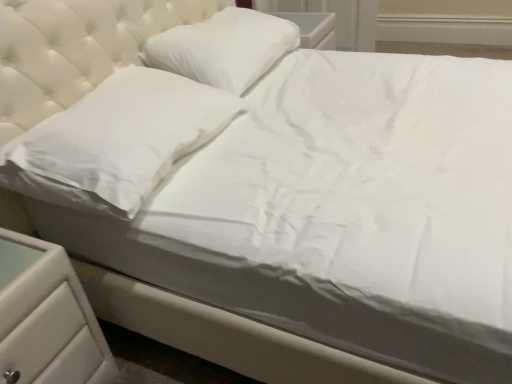
Describe the element at coordinates (224, 48) in the screenshot. I see `white smooth pillow at upper center, the 2th pillow from the front` at that location.

Describe the element at coordinates (116, 141) in the screenshot. I see `white smooth pillow at left, which is the first pillow in front-to-back order` at that location.

Describe the element at coordinates (46, 318) in the screenshot. I see `white plastic drawer at lower left` at that location.

Locate an element on the screen. white smooth pillow at upper center, the 2th pillow from the front is located at coordinates (224, 48).

Which point is more distant from viewer, (88, 336) or (212, 129)?

The point (212, 129) is more distant.

Which object is further away from the camera taking this photo, white plastic drawer at lower left or white smooth pillow at left, which appears as the second pillow when viewed from the back?

white smooth pillow at left, which appears as the second pillow when viewed from the back.

Where is `nightstand in front of the white smooth pillow at left, which is the first pillow in front-to-back order`? nightstand in front of the white smooth pillow at left, which is the first pillow in front-to-back order is located at coordinates coord(46,318).

How different are the orientations of white plastic drawer at lower left and white smooth pillow at left, which appears as the second pillow when viewed from the back, in degrees?

The angle between the facing direction of white plastic drawer at lower left and the facing direction of white smooth pillow at left, which appears as the second pillow when viewed from the back, is 1.81 degrees.

Does white smooth pillow at left, which is the first pillow in front-to-back order, have a greater width compared to white plastic drawer at lower left?

No, white smooth pillow at left, which is the first pillow in front-to-back order, is not wider than white plastic drawer at lower left.

Consider the image. From a real-world perspective, who is located lower, white smooth pillow at left, which appears as the second pillow when viewed from the back, or white plastic drawer at lower left?

From a 3D spatial view, white plastic drawer at lower left is below.

Is point (151, 87) farther from viewer compared to point (36, 293)?

Yes.

Is white smooth pillow at left, which appears as the second pillow when viewed from the back, looking in the opposite direction of white plastic drawer at lower left?

No, white smooth pillow at left, which appears as the second pillow when viewed from the back, is not facing the opposite direction of white plastic drawer at lower left.

Between white plastic drawer at lower left and white smooth pillow at upper center, the 2th pillow from the front, which one has less height?

white smooth pillow at upper center, the 2th pillow from the front.

Is white plastic drawer at lower left not within white smooth pillow at upper center, positioned as the first pillow in back-to-front order?

Indeed, white plastic drawer at lower left is completely outside white smooth pillow at upper center, positioned as the first pillow in back-to-front order.

Considering the sizes of objects white plastic drawer at lower left and white smooth pillow at upper center, positioned as the first pillow in back-to-front order, in the image provided, who is smaller, white plastic drawer at lower left or white smooth pillow at upper center, positioned as the first pillow in back-to-front order,?

white plastic drawer at lower left is smaller.

From the image's perspective, which object appears higher, white smooth pillow at left, which appears as the second pillow when viewed from the back, or white smooth pillow at upper center, the 2th pillow from the front?

white smooth pillow at upper center, the 2th pillow from the front.

This screenshot has width=512, height=384. I want to click on pillow below the white smooth pillow at upper center, the 2th pillow from the front (from the image's perspective), so click(116, 141).

Does point (59, 135) come in front of point (243, 74)?

That is True.

Can we say white smooth pillow at left, which appears as the second pillow when viewed from the back, lies outside white smooth pillow at upper center, positioned as the first pillow in back-to-front order?

white smooth pillow at left, which appears as the second pillow when viewed from the back, lies outside white smooth pillow at upper center, positioned as the first pillow in back-to-front order,'s area.

Is white smooth pillow at upper center, the 2th pillow from the front, in front of white plastic drawer at lower left?

No, it is not.

From the image's perspective, is white smooth pillow at upper center, the 2th pillow from the front, over white plastic drawer at lower left?

Yes.

In order to click on the 2nd pillow above the white plastic drawer at lower left (from the image's perspective) in this screenshot , I will do `click(224, 48)`.

Considering the sizes of white smooth pillow at upper center, the 2th pillow from the front, and white smooth pillow at left, which is the first pillow in front-to-back order, in the image, is white smooth pillow at upper center, the 2th pillow from the front, bigger or smaller than white smooth pillow at left, which is the first pillow in front-to-back order,?

Considering their sizes, white smooth pillow at upper center, the 2th pillow from the front, takes up more space than white smooth pillow at left, which is the first pillow in front-to-back order.

From the image's perspective, which one is positioned higher, white smooth pillow at upper center, positioned as the first pillow in back-to-front order, or white smooth pillow at left, which is the first pillow in front-to-back order?

white smooth pillow at upper center, positioned as the first pillow in back-to-front order.

Is white smooth pillow at upper center, the 2th pillow from the front, touching white smooth pillow at left, which appears as the second pillow when viewed from the back?

No, white smooth pillow at upper center, the 2th pillow from the front, is not beside white smooth pillow at left, which appears as the second pillow when viewed from the back.

Find the location of a particular element. The image size is (512, 384). nightstand on the left of white smooth pillow at left, which appears as the second pillow when viewed from the back is located at coordinates (46, 318).

Where is `nightstand in front of the white smooth pillow at left, which appears as the second pillow when viewed from the back`? nightstand in front of the white smooth pillow at left, which appears as the second pillow when viewed from the back is located at coordinates (46, 318).

When comparing their distances from white smooth pillow at upper center, positioned as the first pillow in back-to-front order, does white plastic drawer at lower left or white smooth pillow at left, which is the first pillow in front-to-back order, seem closer?

Among the two, white smooth pillow at left, which is the first pillow in front-to-back order, is located nearer to white smooth pillow at upper center, positioned as the first pillow in back-to-front order.

Estimate the real-world distances between objects in this image. Which object is further from white smooth pillow at left, which appears as the second pillow when viewed from the back, white smooth pillow at upper center, the 2th pillow from the front, or white plastic drawer at lower left?

Based on the image, white smooth pillow at upper center, the 2th pillow from the front, appears to be further to white smooth pillow at left, which appears as the second pillow when viewed from the back.

From the image, which object appears to be farther from white smooth pillow at left, which is the first pillow in front-to-back order, white plastic drawer at lower left or white smooth pillow at upper center, the 2th pillow from the front?

white smooth pillow at upper center, the 2th pillow from the front, is further to white smooth pillow at left, which is the first pillow in front-to-back order.

Consider the image. Which object lies further to the anchor point white plastic drawer at lower left, white smooth pillow at left, which appears as the second pillow when viewed from the back, or white smooth pillow at upper center, positioned as the first pillow in back-to-front order?

Among the two, white smooth pillow at upper center, positioned as the first pillow in back-to-front order, is located further to white plastic drawer at lower left.

Estimate the real-world distances between objects in this image. Which object is further from white plastic drawer at lower left, white smooth pillow at upper center, positioned as the first pillow in back-to-front order, or white smooth pillow at left, which appears as the second pillow when viewed from the back?

white smooth pillow at upper center, positioned as the first pillow in back-to-front order, lies further to white plastic drawer at lower left than the other object.

When comparing their distances from white smooth pillow at upper center, positioned as the first pillow in back-to-front order, does white smooth pillow at left, which appears as the second pillow when viewed from the back, or white plastic drawer at lower left seem further?

Based on the image, white plastic drawer at lower left appears to be further to white smooth pillow at upper center, positioned as the first pillow in back-to-front order.

Image resolution: width=512 pixels, height=384 pixels. I want to click on pillow that lies between white smooth pillow at upper center, positioned as the first pillow in back-to-front order, and white plastic drawer at lower left from top to bottom, so click(x=116, y=141).